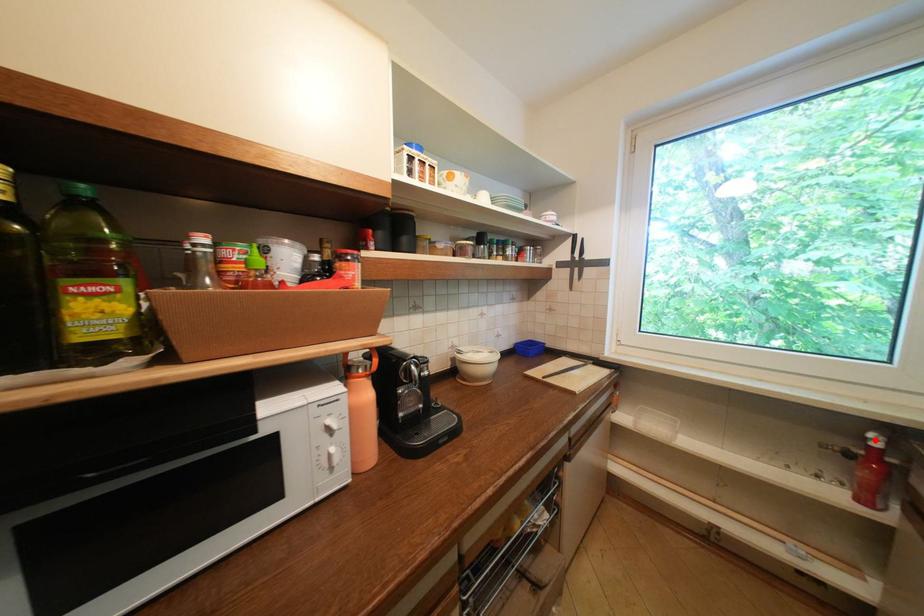
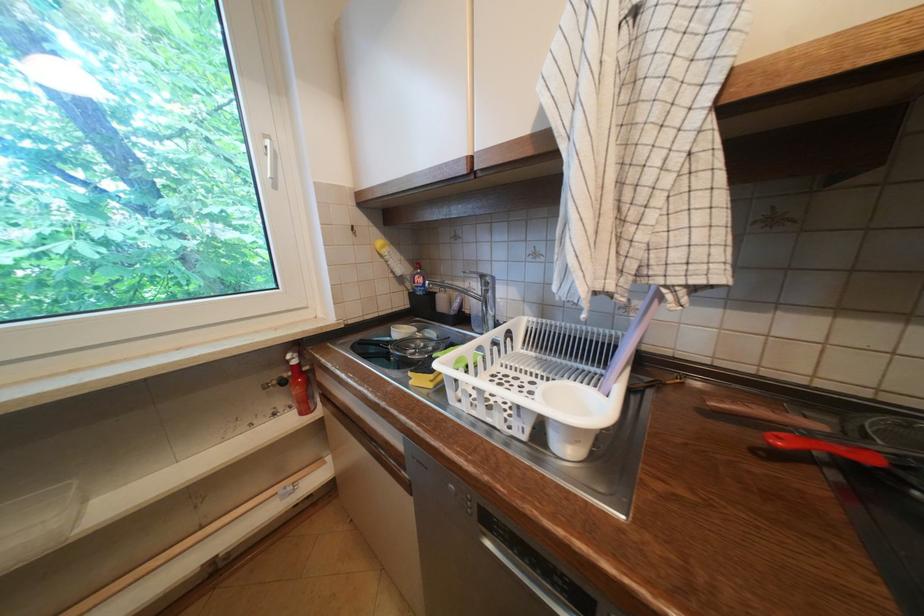
Where in the second image is the point corresponding to the highlighted location from the first image?

(296, 362)